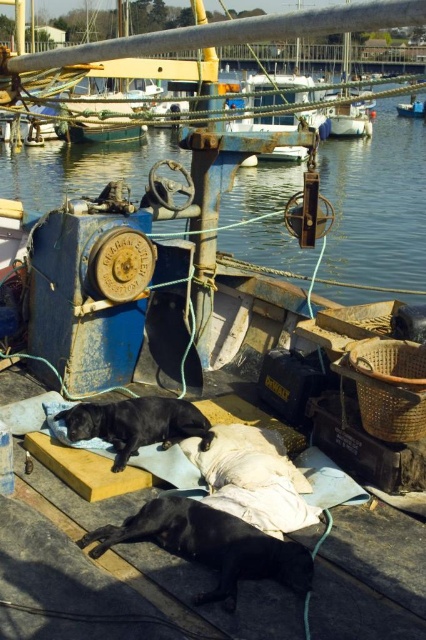
Question: Can you confirm if blue metallic water at center is bigger than shiny black dog at lower center?

Choices:
 (A) yes
 (B) no

Answer: (A)

Question: Which object appears closest to the camera in this image?

Choices:
 (A) shiny black dog at lower center
 (B) blue metallic water at center

Answer: (A)

Question: Is shiny black dog at lower center positioned in front of black matte dog at center?

Choices:
 (A) yes
 (B) no

Answer: (A)

Question: Does blue metallic water at center appear on the right side of shiny black dog at lower center?

Choices:
 (A) no
 (B) yes

Answer: (B)

Question: Among these points, which one is farthest from the camera?

Choices:
 (A) (261, 195)
 (B) (126, 406)
 (C) (279, 563)

Answer: (A)

Question: Based on their relative distances, which object is farther from the shiny black dog at lower center?

Choices:
 (A) black matte dog at center
 (B) blue metallic water at center

Answer: (B)